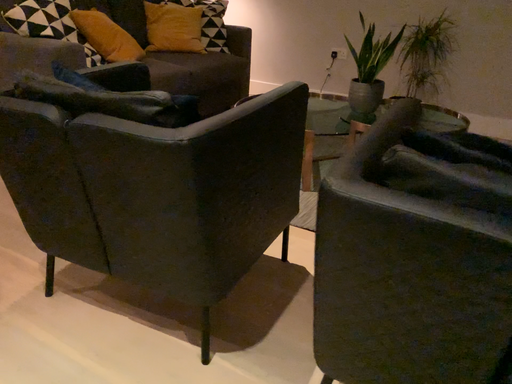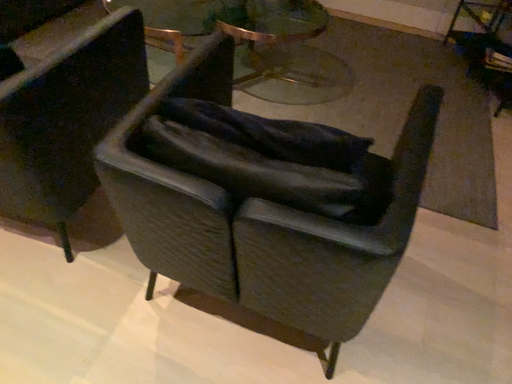
Question: How did the camera likely rotate when shooting the video?

Choices:
 (A) rotated right
 (B) rotated left

Answer: (A)